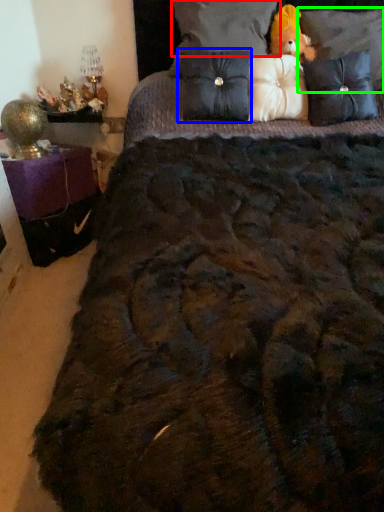
Question: Considering the real-world distances, which object is closest to pillow (highlighted by a red box)? pillow (highlighted by a blue box) or pillow (highlighted by a green box).

Choices:
 (A) pillow
 (B) pillow

Answer: (A)